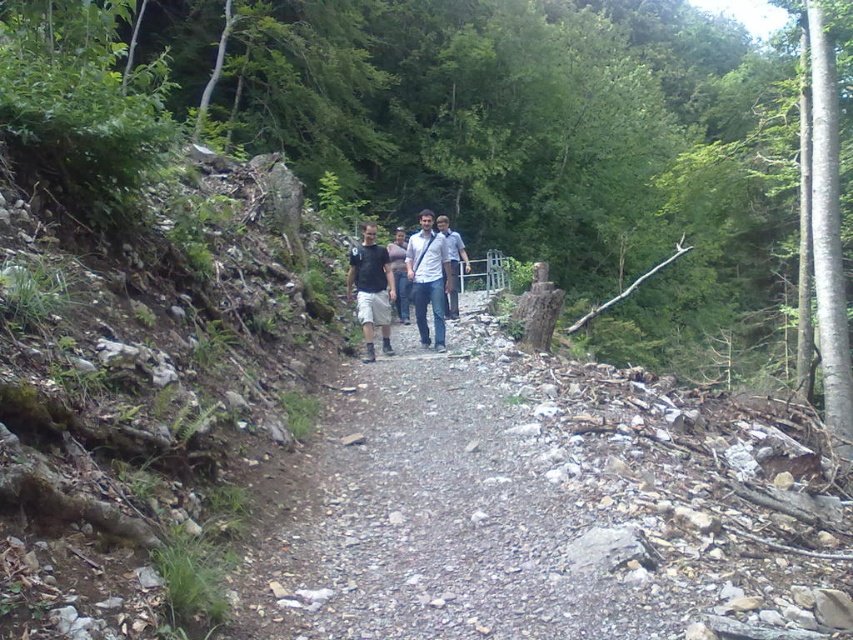
You are a hiker on the narrow, rocky path in the forest. You notice two people ahead of you wearing the dark gray fabric shirt at center and the white matte shirt at center. Which person should you follow to stay on the path more safely?

You should follow the dark gray fabric shirt at center because it is closer to you, meaning they are ahead on the path and can guide you safely.

You are a hiker planning to walk on the narrow rocky path in the forest. You notice two people wearing the dark gray fabric shirt at center and the white matte shirt at center. Which person do you think has a wider torso? Explain your reasoning based on the clothing.

The dark gray fabric shirt at center has a larger width than the white matte shirt at center, indicating that the person wearing the dark gray fabric shirt at center likely has a wider torso.